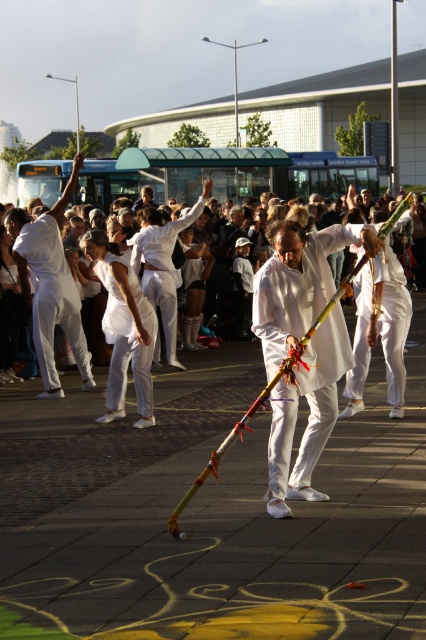
Question: Does white silk robe at center have a larger size compared to white matte/soft fabric man at left?

Choices:
 (A) yes
 (B) no

Answer: (B)

Question: Which of the following is the farthest from the observer?

Choices:
 (A) white clothed people at center
 (B) white matte/soft robe at center

Answer: (A)

Question: Can you confirm if white matte robe at center is positioned to the right of white matte/soft robe at center?

Choices:
 (A) yes
 (B) no

Answer: (A)

Question: Is white silk robe at center thinner than white matte robe at center?

Choices:
 (A) yes
 (B) no

Answer: (B)

Question: Which point is farther from the camera taking this photo?

Choices:
 (A) (71, 342)
 (B) (141, 412)

Answer: (A)

Question: Which object is the farthest from the white matte/soft robe at center?

Choices:
 (A) white silk robe at center
 (B) white clothed people at center
 (C) white matte/soft fabric man at left

Answer: (A)